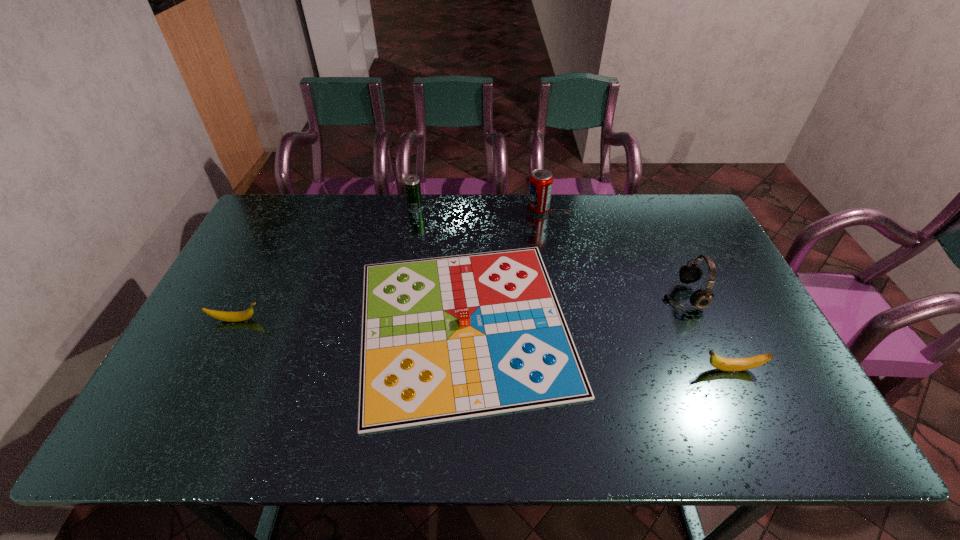
At what (x,y) coordinates should I click in order to perform the action: click on free spot between the shortest object and the right banana. Please return your answer as a coordinate pair (x, y). Looking at the image, I should click on (597, 347).

Image resolution: width=960 pixels, height=540 pixels. In order to click on blank region between the beer can and the soda can in this screenshot , I will do `click(476, 208)`.

The image size is (960, 540). I want to click on empty space between the soda can and the right banana, so click(635, 290).

Locate an element on the screen. Image resolution: width=960 pixels, height=540 pixels. unoccupied area between the right banana and the soda can is located at coordinates (635, 290).

Locate which object ranks second in proximity to the leftmost object. Please provide its 2D coordinates. Your answer should be formatted as a tuple, i.e. [(x, y)], where the tuple contains the x and y coordinates of a point satisfying the conditions above.

[(412, 183)]

Image resolution: width=960 pixels, height=540 pixels. What are the coordinates of `object that is the second nearest to the beer can` in the screenshot? It's located at (541, 180).

Find the location of a particular element. This screenshot has height=540, width=960. free space that satisfies the following two spatial constraints: 1. with the microphone on the side of the headset; 2. on the front side of the gameboard is located at coordinates (695, 325).

Where is `vacant space that satisfies the following two spatial constraints: 1. at the stem of the left banana; 2. on the left side of the shortest object`? vacant space that satisfies the following two spatial constraints: 1. at the stem of the left banana; 2. on the left side of the shortest object is located at coordinates pyautogui.click(x=234, y=325).